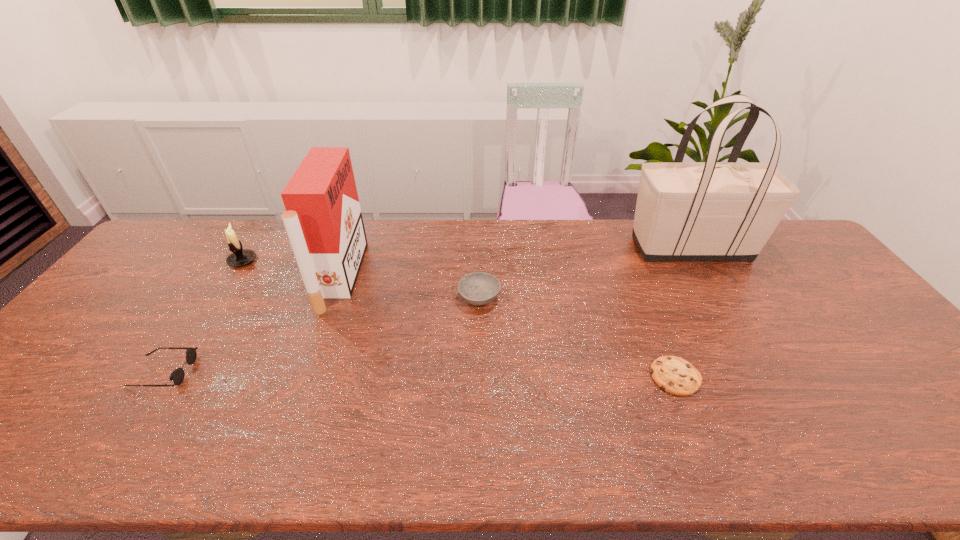
Where is `empty location between the second shortest object and the shortest object`? This screenshot has width=960, height=540. empty location between the second shortest object and the shortest object is located at coordinates (420, 374).

At what (x,y) coordinates should I click in order to perform the action: click on vacant area that lies between the shortest object and the third tallest object. Please return your answer as a coordinate pair (x, y). The width and height of the screenshot is (960, 540). Looking at the image, I should click on (459, 319).

Identify the location of empty space that is in between the tallest object and the candle holder. This screenshot has width=960, height=540. (467, 254).

Locate an element on the screen. This screenshot has width=960, height=540. object that ranks as the second closest to the sunglasses is located at coordinates (240, 257).

Select which object is the third closest to the shortest object. Please provide its 2D coordinates. Your answer should be formatted as a tuple, i.e. [(x, y)], where the tuple contains the x and y coordinates of a point satisfying the conditions above.

[(323, 219)]

Identify the location of free spot that satisfies the following two spatial constraints: 1. on the front-facing side of the cigarette case; 2. on the left side of the cookie. This screenshot has height=540, width=960. (304, 376).

Locate an element on the screen. This screenshot has width=960, height=540. vacant space that satisfies the following two spatial constraints: 1. on the front-facing side of the cookie; 2. on the left side of the fifth tallest object is located at coordinates (159, 376).

Find the location of a particular element. The height and width of the screenshot is (540, 960). vacant region that satisfies the following two spatial constraints: 1. on the front-facing side of the fifth tallest object; 2. on the back side of the shortest object is located at coordinates (159, 376).